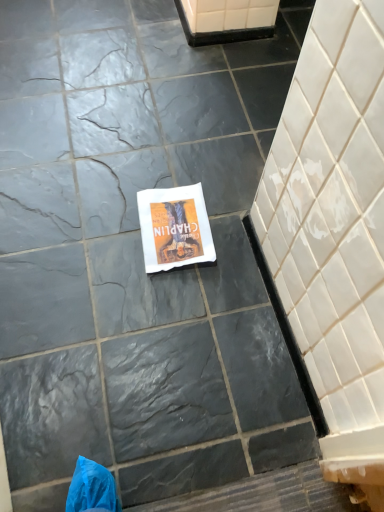
Identify the location of blank space situated above white paper towel at center (from a real-world perspective). This screenshot has height=512, width=384. (169, 220).